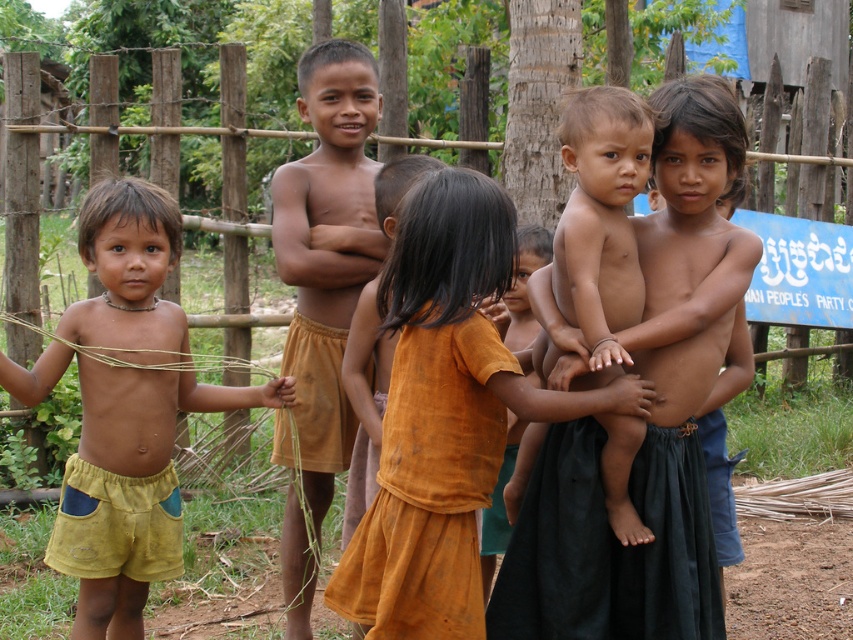
Question: Does brown skin boy at center appear on the right side of yellow cotton shorts at left?

Choices:
 (A) yes
 (B) no

Answer: (A)

Question: Which of the following is the farthest from the observer?

Choices:
 (A) brown cotton shorts at center
 (B) brown skin boy at center
 (C) yellow cotton shorts at left
 (D) orange cotton dress at center

Answer: (A)

Question: Which point is farther from the camera taking this photo?

Choices:
 (A) (291, 216)
 (B) (476, 579)
 (C) (688, 452)

Answer: (A)

Question: Is brown skin boy at center above brown cotton shorts at center?

Choices:
 (A) no
 (B) yes

Answer: (B)

Question: Is brown skin boy at center further to camera compared to brown cotton shorts at center?

Choices:
 (A) no
 (B) yes

Answer: (A)

Question: Which is nearer to the orange cotton dress at center?

Choices:
 (A) brown cotton shorts at center
 (B) brown skin boy at center
 (C) yellow cotton shorts at left

Answer: (B)